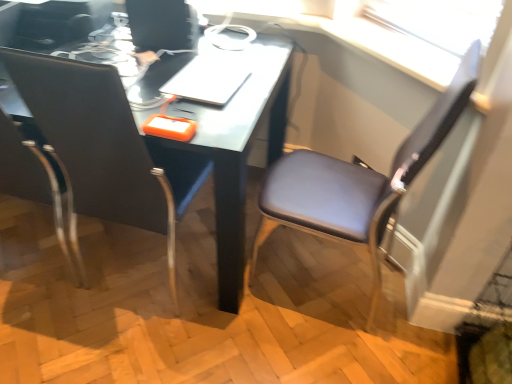
Locate an element on the screen. The height and width of the screenshot is (384, 512). vacant area that lies between black leather chair at left, the second chair viewed from the right, and matte black chair at right, the second chair in the left-to-right sequence is located at coordinates (247, 291).